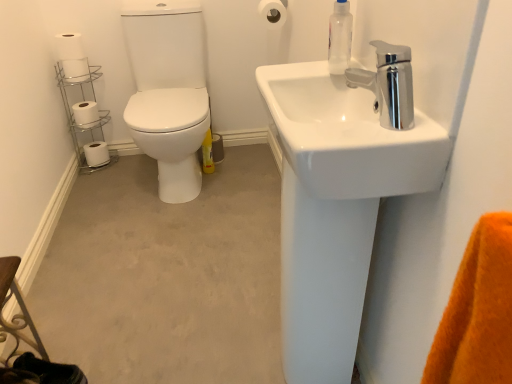
Question: Could you tell me if transparent plastic soap dispenser at upper right is facing white glossy sink at upper right?

Choices:
 (A) no
 (B) yes

Answer: (A)

Question: From the image's perspective, is transparent plastic soap dispenser at upper right over white glossy sink at upper right?

Choices:
 (A) no
 (B) yes

Answer: (B)

Question: Can you confirm if transparent plastic soap dispenser at upper right is smaller than white glossy sink at upper right?

Choices:
 (A) yes
 (B) no

Answer: (A)

Question: Are transparent plastic soap dispenser at upper right and white glossy sink at upper right making contact?

Choices:
 (A) yes
 (B) no

Answer: (B)

Question: Does transparent plastic soap dispenser at upper right appear on the left side of white glossy sink at upper right?

Choices:
 (A) yes
 (B) no

Answer: (B)

Question: From a real-world perspective, is chrome/metallic toilet paper holder at left positioned above or below white glossy sink at upper right?

Choices:
 (A) below
 (B) above

Answer: (A)

Question: In the image, is chrome/metallic toilet paper holder at left on the left side or the right side of white glossy sink at upper right?

Choices:
 (A) right
 (B) left

Answer: (B)

Question: In terms of width, does chrome/metallic toilet paper holder at left look wider or thinner when compared to white glossy sink at upper right?

Choices:
 (A) thin
 (B) wide

Answer: (A)

Question: In terms of size, does chrome/metallic toilet paper holder at left appear bigger or smaller than white glossy sink at upper right?

Choices:
 (A) small
 (B) big

Answer: (B)

Question: Is white matte toilet paper at upper left, the fourth toilet paper in the back-to-front sequence, wider or thinner than white matte toilet paper at upper center, which is the 2th toilet paper from top to bottom?

Choices:
 (A) thin
 (B) wide

Answer: (A)

Question: From a real-world perspective, is white matte toilet paper at upper left, the fourth toilet paper viewed from the left, physically located above or below white matte toilet paper at upper center, which is the 2th toilet paper from top to bottom?

Choices:
 (A) above
 (B) below

Answer: (B)

Question: Choose the correct answer: Is white matte toilet paper at upper left, the 5th toilet paper when ordered from bottom to top, inside white matte toilet paper at upper center, which is the 2th toilet paper from top to bottom, or outside it?

Choices:
 (A) outside
 (B) inside

Answer: (A)

Question: Considering their positions, is white matte toilet paper at upper left, arranged as the 2th toilet paper when viewed from the front, located in front of or behind white matte toilet paper at upper center, which appears as the 1th toilet paper when viewed from the front?

Choices:
 (A) front
 (B) behind

Answer: (B)

Question: Considering the positions of point (287, 142) and point (65, 59), is point (287, 142) closer or farther from the camera than point (65, 59)?

Choices:
 (A) farther
 (B) closer

Answer: (B)

Question: In terms of width, does white glossy sink at upper right look wider or thinner when compared to white matte toilet paper at upper left, which is the 3th toilet paper in bottom-to-top order?

Choices:
 (A) thin
 (B) wide

Answer: (B)